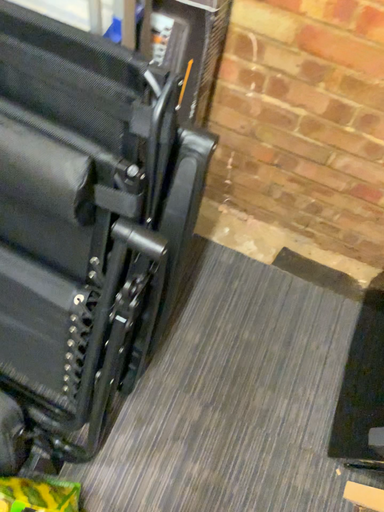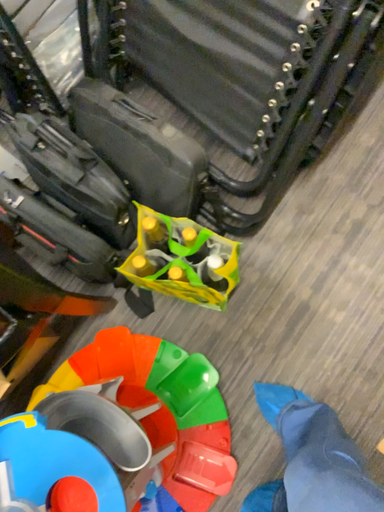
Question: How did the camera likely rotate when shooting the video?

Choices:
 (A) rotated right
 (B) rotated left

Answer: (B)